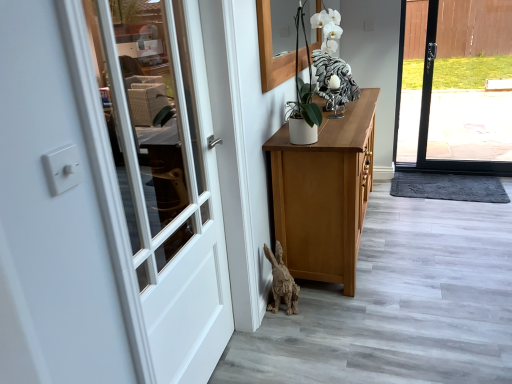
Question: Do you think wooden rabbit at lower center, the second animal from the back, is within white glossy rooster at upper center, the 1th animal positioned from the top, or outside of it?

Choices:
 (A) outside
 (B) inside

Answer: (A)

Question: Does point (275, 248) appear closer or farther from the camera than point (345, 89)?

Choices:
 (A) farther
 (B) closer

Answer: (B)

Question: Considering the real-world distances, which object is farthest from the white glossy rooster at upper center, acting as the 2th animal starting from the front?

Choices:
 (A) wooden rabbit at lower center, the second animal viewed from the right
 (B) dark gray textured mat at lower right
 (C) white wood door at left
 (D) wooden frame at upper center

Answer: (B)

Question: Estimate the real-world distances between objects in this image. Which object is farther from the white wood door at left?

Choices:
 (A) wooden frame at upper center
 (B) wooden rabbit at lower center, the 1th animal viewed from the left
 (C) white glossy rooster at upper center, acting as the 2th animal starting from the front
 (D) dark gray textured mat at lower right

Answer: (D)